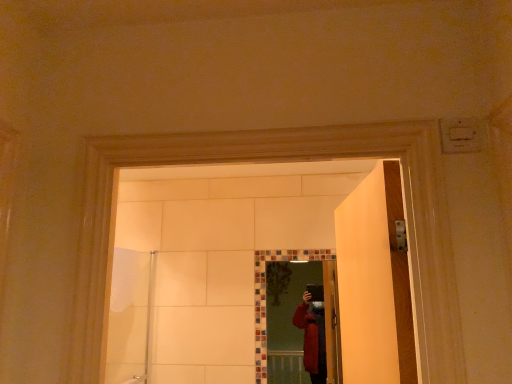
Question: Considering the positions of multicolored mosaic mirror at center and white fabric shower door at left in the image, is multicolored mosaic mirror at center wider or thinner than white fabric shower door at left?

Choices:
 (A) wide
 (B) thin

Answer: (B)

Question: From a real-world perspective, is multicolored mosaic mirror at center physically located above or below white fabric shower door at left?

Choices:
 (A) below
 (B) above

Answer: (B)

Question: Is point (331, 309) closer or farther from the camera than point (136, 374)?

Choices:
 (A) farther
 (B) closer

Answer: (B)

Question: Would you say white fabric shower door at left is to the left or to the right of multicolored mosaic mirror at center in the picture?

Choices:
 (A) right
 (B) left

Answer: (B)

Question: Is white fabric shower door at left inside the boundaries of multicolored mosaic mirror at center, or outside?

Choices:
 (A) outside
 (B) inside

Answer: (A)

Question: Relative to multicolored mosaic mirror at center, is white fabric shower door at left in front or behind?

Choices:
 (A) front
 (B) behind

Answer: (A)

Question: Considering the positions of white fabric shower door at left and multicolored mosaic mirror at center in the image, is white fabric shower door at left taller or shorter than multicolored mosaic mirror at center?

Choices:
 (A) tall
 (B) short

Answer: (A)